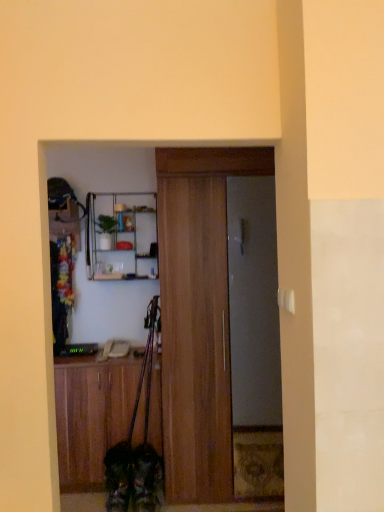
Question: Considering the relative sizes of metallic silver shelf at upper center and wooden door at center, which is the second door from back to front, in the image provided, is metallic silver shelf at upper center smaller than wooden door at center, which is the second door from back to front,?

Choices:
 (A) yes
 (B) no

Answer: (A)

Question: From a real-world perspective, is metallic silver shelf at upper center on top of wooden door at center, which is the second door from back to front?

Choices:
 (A) yes
 (B) no

Answer: (A)

Question: From the image's perspective, is metallic silver shelf at upper center beneath wooden door at center, positioned as the first door in front-to-back order?

Choices:
 (A) yes
 (B) no

Answer: (B)

Question: Considering the relative sizes of metallic silver shelf at upper center and wooden door at center, which is the second door from back to front, in the image provided, is metallic silver shelf at upper center bigger than wooden door at center, which is the second door from back to front,?

Choices:
 (A) no
 (B) yes

Answer: (A)

Question: Is metallic silver shelf at upper center to the right of wooden door at center, which is the second door from back to front, from the viewer's perspective?

Choices:
 (A) yes
 (B) no

Answer: (B)

Question: From the image's perspective, relative to wooden door at center, which is the second door from back to front, is metallic silver shelf at upper center above or below?

Choices:
 (A) above
 (B) below

Answer: (A)

Question: Based on their positions, is metallic silver shelf at upper center located to the left or right of wooden door at center, positioned as the first door in front-to-back order?

Choices:
 (A) right
 (B) left

Answer: (B)

Question: From a real-world perspective, is metallic silver shelf at upper center above or below wooden door at center, positioned as the first door in front-to-back order?

Choices:
 (A) above
 (B) below

Answer: (A)

Question: In terms of size, does metallic silver shelf at upper center appear bigger or smaller than wooden door at center, positioned as the first door in front-to-back order?

Choices:
 (A) big
 (B) small

Answer: (B)

Question: Based on their sizes in the image, would you say metallic silver shelf at upper center is bigger or smaller than wooden cabinet at lower left?

Choices:
 (A) small
 (B) big

Answer: (A)

Question: Looking at their shapes, would you say metallic silver shelf at upper center is wider or thinner than wooden cabinet at lower left?

Choices:
 (A) wide
 (B) thin

Answer: (A)

Question: From the image's perspective, is metallic silver shelf at upper center positioned above or below wooden cabinet at lower left?

Choices:
 (A) below
 (B) above

Answer: (B)

Question: Is point (125, 209) positioned closer to the camera than point (127, 365)?

Choices:
 (A) closer
 (B) farther

Answer: (B)

Question: Considering the relative positions of fluffy brown dog at lower center and wooden door at center, positioned as the first door in front-to-back order, in the image provided, is fluffy brown dog at lower center to the left or to the right of wooden door at center, positioned as the first door in front-to-back order,?

Choices:
 (A) left
 (B) right

Answer: (A)

Question: Considering the positions of fluffy brown dog at lower center and wooden door at center, positioned as the first door in front-to-back order, in the image, is fluffy brown dog at lower center wider or thinner than wooden door at center, positioned as the first door in front-to-back order,?

Choices:
 (A) wide
 (B) thin

Answer: (B)